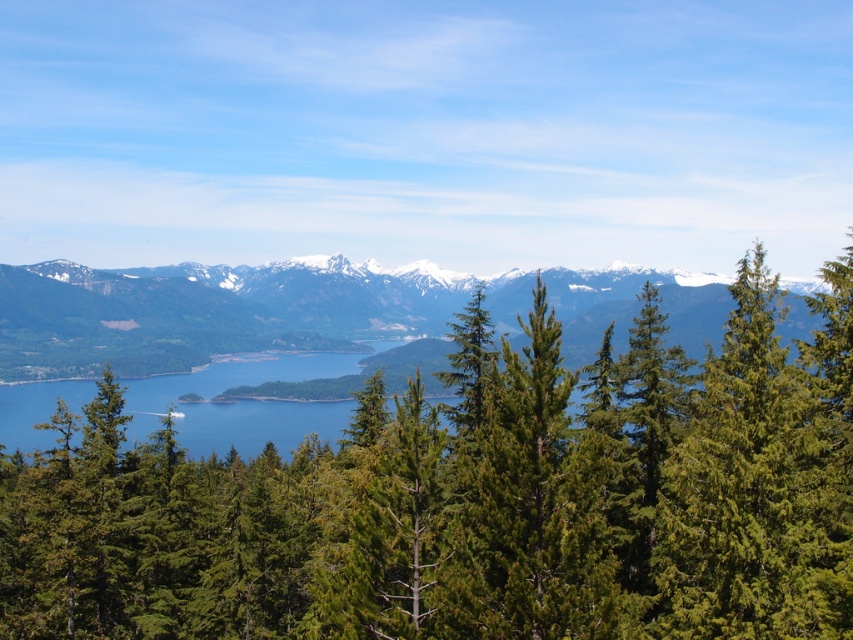
Who is more distant from viewer, (x=741, y=401) or (x=625, y=296)?

The point (x=625, y=296) is more distant.

Is point (548, 364) more distant than point (299, 280)?

That is False.

The image size is (853, 640). Find the location of `green needle-like trees at center`. green needle-like trees at center is located at coordinates (473, 500).